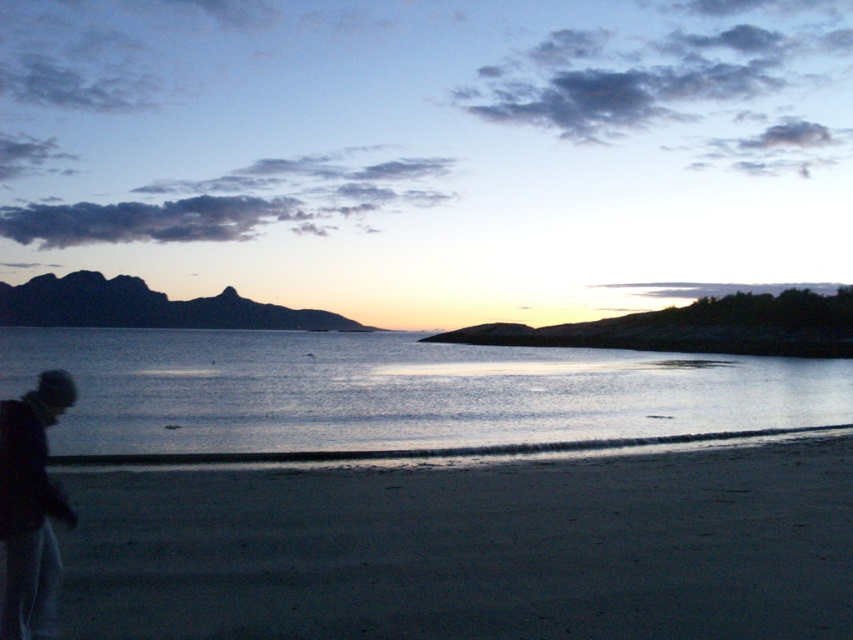
Question: Which object is positioned farthest from the glistening water at center?

Choices:
 (A) dark sand at lower left
 (B) dark gray woolen hat at lower left

Answer: (B)

Question: Can you confirm if dark sand at lower left is positioned above dark gray woolen hat at lower left?

Choices:
 (A) no
 (B) yes

Answer: (A)

Question: Is glistening water at center bigger than dark gray woolen hat at lower left?

Choices:
 (A) no
 (B) yes

Answer: (B)

Question: Which of the following is the farthest from the observer?

Choices:
 (A) (35, 374)
 (B) (3, 547)

Answer: (A)

Question: Can you confirm if glistening water at center is smaller than dark gray woolen hat at lower left?

Choices:
 (A) yes
 (B) no

Answer: (B)

Question: Among these objects, which one is nearest to the camera?

Choices:
 (A) glistening water at center
 (B) dark gray woolen hat at lower left

Answer: (B)